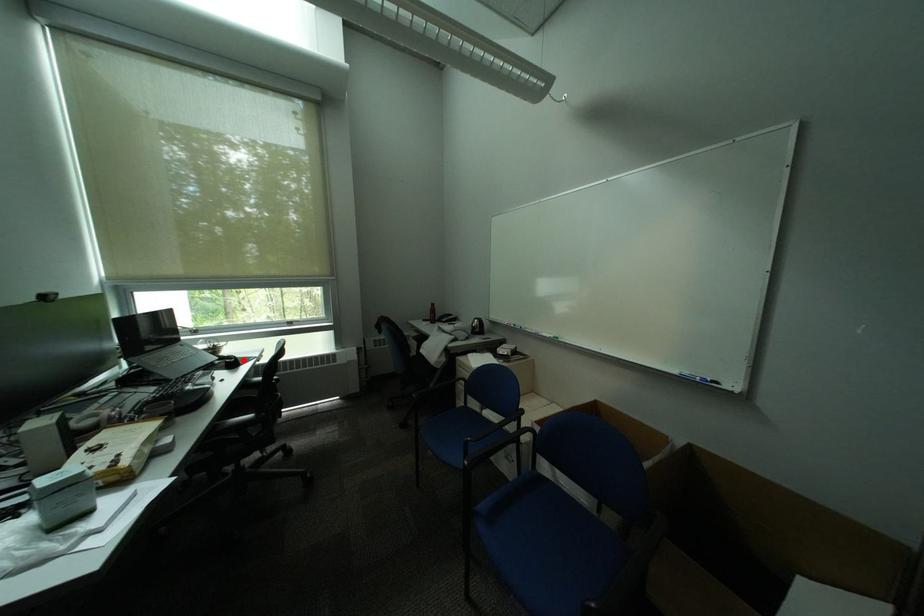
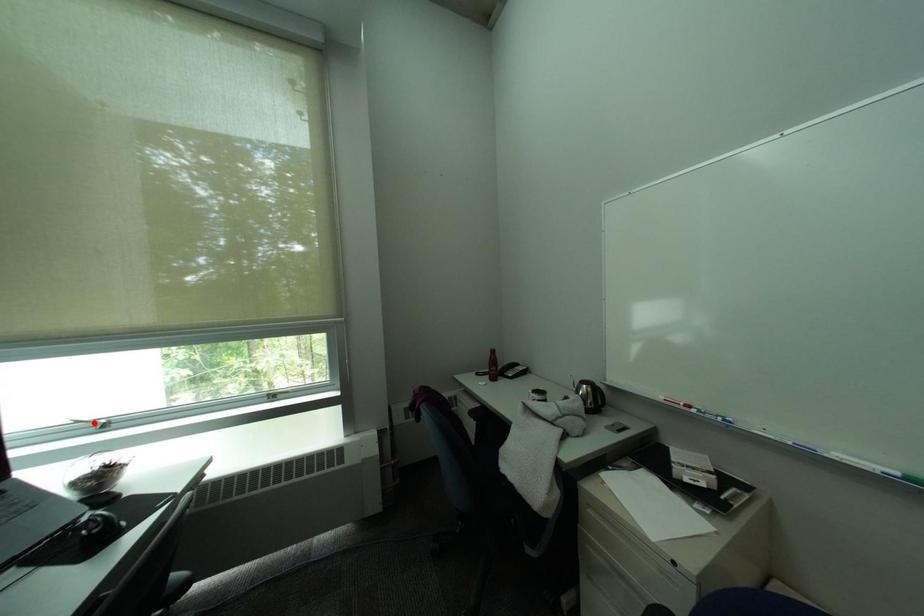
I am providing you with two images of the same scene from different viewpoints. A red point is marked on the first image and another point is marked on the second image. Is the marked point in image1 the same physical position as the marked point in image2?

No